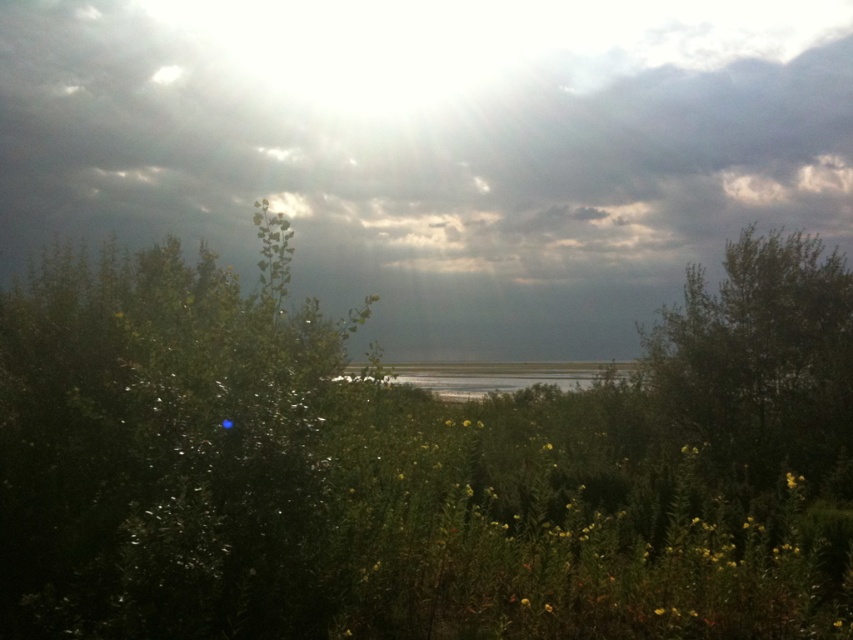
Question: Based on their relative distances, which object is nearer to the green grassy lake at center?

Choices:
 (A) gray cloudy sky at upper center
 (B) green leafy bush at left
 (C) green leafy tree at right

Answer: (C)

Question: Is gray cloudy sky at upper center closer to camera compared to green grassy lake at center?

Choices:
 (A) no
 (B) yes

Answer: (A)

Question: Estimate the real-world distances between objects in this image. Which object is farther from the green grassy lake at center?

Choices:
 (A) gray cloudy sky at upper center
 (B) green leafy bush at left

Answer: (B)

Question: Can you confirm if gray cloudy sky at upper center is smaller than green grassy lake at center?

Choices:
 (A) yes
 (B) no

Answer: (B)

Question: Which object is the farthest from the green leafy tree at right?

Choices:
 (A) green grassy lake at center
 (B) green leafy bush at left

Answer: (B)

Question: In this image, where is gray cloudy sky at upper center located relative to green leafy bush at left?

Choices:
 (A) right
 (B) left

Answer: (A)